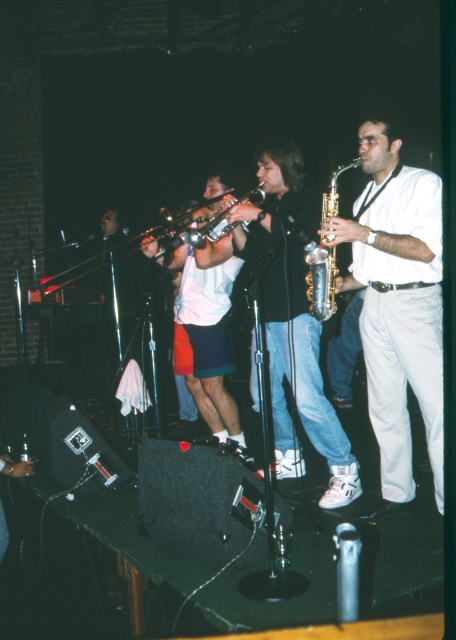
You are a stagehand setting up a music stand for the performers. You need to place the stand between the white matte saxophone at center and the shiny silver trumpet at center. Since the saxophone is taller, where should you position the stand to avoid blocking the trumpet player?

The white matte saxophone at center is much taller than the shiny silver trumpet at center, so you should place the music stand closer to the saxophone to avoid blocking the trumpet player.

You are standing in the audience and see the point at coordinates point (385, 268) on the stage. The venue has a safety rule that audience members must stay at least 3 meters away from any stage points. Is your current position compliant with this rule?

The point at coordinates point (385, 268) is 3.12 meters away from the viewer, which is just over the required 3 meters. Therefore, the current position is compliant with the safety rule.